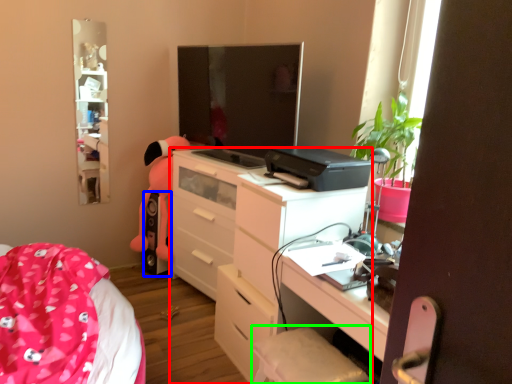
Question: Which object is the farthest from chest of drawers (highlighted by a red box)? Choose among these: speaker (highlighted by a blue box) or swivel chair (highlighted by a green box).

Choices:
 (A) speaker
 (B) swivel chair

Answer: (A)